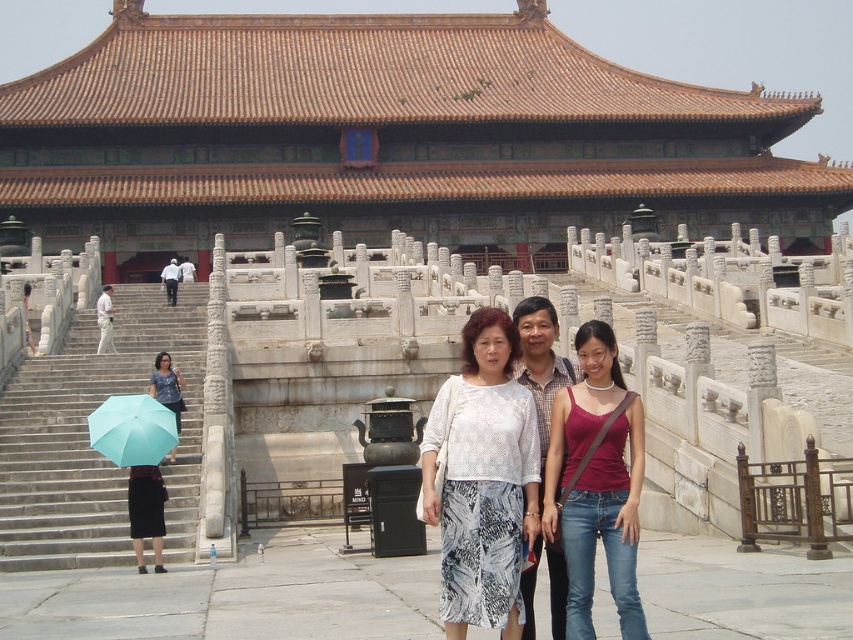
Who is shorter, matte red tank top at center or light blue fabric umbrella at lower left?

light blue fabric umbrella at lower left

Does matte red tank top at center have a greater width compared to light blue fabric umbrella at lower left?

Indeed, matte red tank top at center has a greater width compared to light blue fabric umbrella at lower left.

Find the location of a particular element. matte red tank top at center is located at coordinates (596, 483).

Does point (184, 61) lie behind point (177, 422)?

Yes, point (184, 61) is farther from viewer.

Does brown glazed tile roof at center have a lesser height compared to matte blue umbrella at lower left?

Incorrect, brown glazed tile roof at center's height does not fall short of matte blue umbrella at lower left's.

Describe the element at coordinates (386, 138) in the screenshot. This screenshot has height=640, width=853. I see `brown glazed tile roof at center` at that location.

Image resolution: width=853 pixels, height=640 pixels. In order to click on brown glazed tile roof at center in this screenshot , I will do `click(386, 138)`.

Does light blue fabric umbrella at left come in front of white lace blouse at center?

That is False.

Does light blue fabric umbrella at left appear under white lace blouse at center?

No.

Is point (28, 536) more distant than point (495, 428)?

That is True.

I want to click on light blue fabric umbrella at left, so click(86, 438).